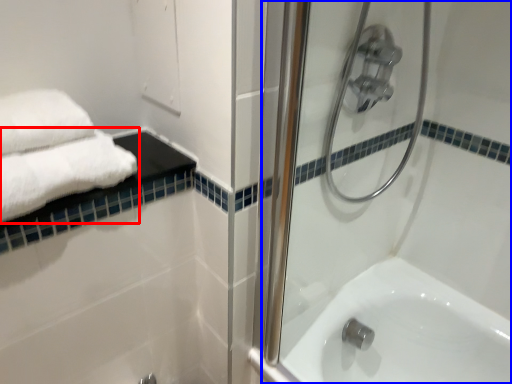
Question: Which object appears closest to the camera in this image, towel (highlighted by a red box) or shower door (highlighted by a blue box)?

Choices:
 (A) towel
 (B) shower door

Answer: (B)